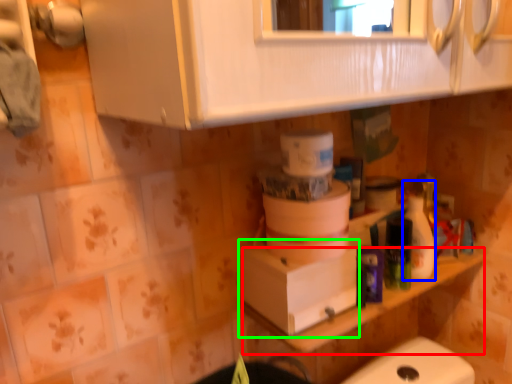
Question: Considering the real-world distances, which object is farthest from counter top (highlighted by a red box)? cleaning product (highlighted by a blue box) or cardboard box (highlighted by a green box)?

Choices:
 (A) cleaning product
 (B) cardboard box

Answer: (A)